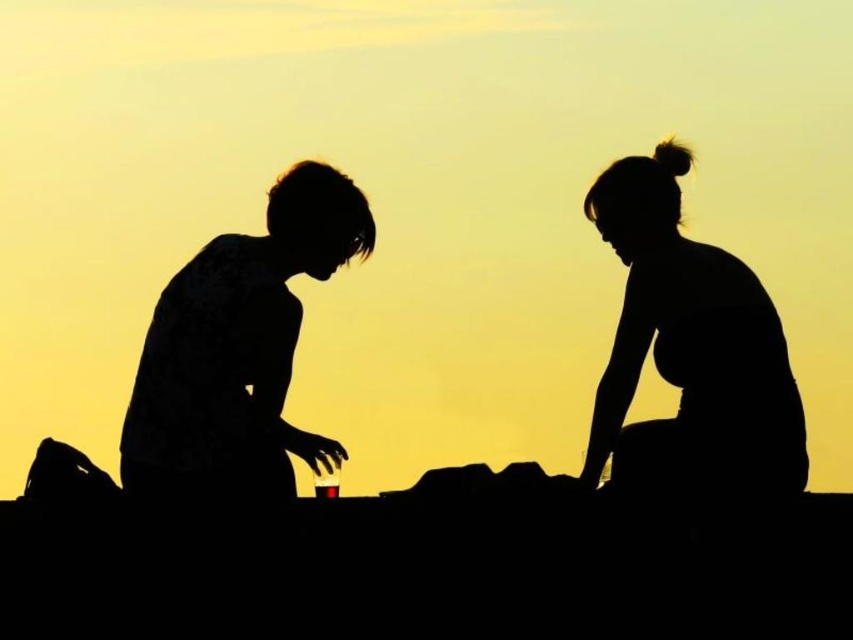
Question: Estimate the real-world distances between objects in this image. Which object is closer to the silhouette figures at center?

Choices:
 (A) silhouette hair at upper right
 (B) silhouette shirt at left

Answer: (A)

Question: Which of the following is the farthest from the observer?

Choices:
 (A) (624, 353)
 (B) (175, 365)

Answer: (B)

Question: Which point appears farthest from the camera in this image?

Choices:
 (A) (758, 413)
 (B) (711, 342)
 (C) (317, 236)

Answer: (C)

Question: Can you confirm if silhouette hair at upper right is bigger than silhouette shirt at left?

Choices:
 (A) yes
 (B) no

Answer: (B)

Question: Is silhouette figures at center positioned behind silhouette hair at upper right?

Choices:
 (A) no
 (B) yes

Answer: (B)

Question: Is silhouette hair at upper right positioned before silhouette shirt at left?

Choices:
 (A) no
 (B) yes

Answer: (B)